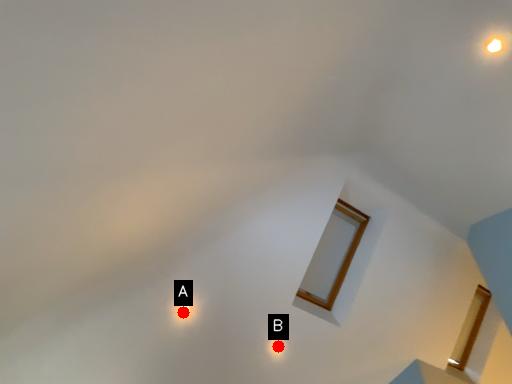
Question: Two points are circled on the image, labeled by A and B beside each circle. Among these points, which one is farthest from the camera?

Choices:
 (A) A is further
 (B) B is further

Answer: (B)